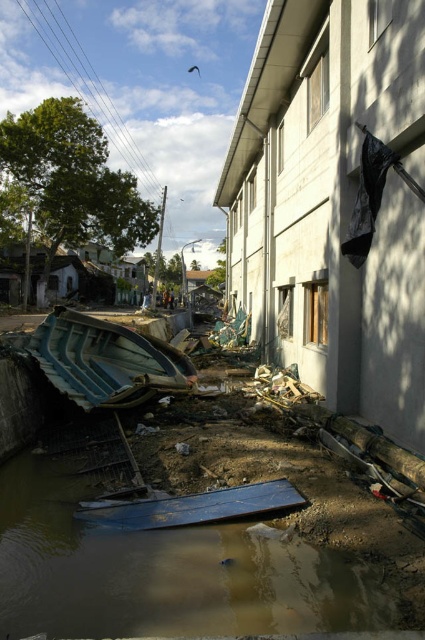
Does brown muddy water at lower left have a greater height compared to blue fiberglass boat at lower left?

In fact, brown muddy water at lower left may be shorter than blue fiberglass boat at lower left.

Who is shorter, brown muddy water at lower left or blue fiberglass boat at lower left?

With less height is brown muddy water at lower left.

This screenshot has height=640, width=425. Identify the location of brown muddy water at lower left. (164, 572).